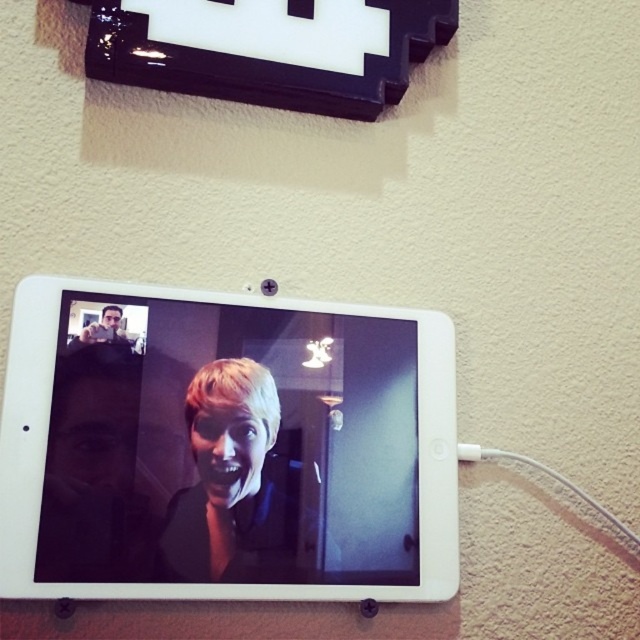
Question: Is white glossy tablet at center above matte black face at upper left?

Choices:
 (A) yes
 (B) no

Answer: (B)

Question: Is matte black face at left wider than matte black face at upper left?

Choices:
 (A) no
 (B) yes

Answer: (B)

Question: Is white glossy tablet at center closer to camera compared to matte black face at left?

Choices:
 (A) yes
 (B) no

Answer: (A)

Question: Estimate the real-world distances between objects in this image. Which object is farther from the white glossy tablet at center?

Choices:
 (A) matte black face at left
 (B) matte black face at upper left

Answer: (B)

Question: Among these points, which one is farthest from the camera?

Choices:
 (A) (248, 476)
 (B) (60, 394)

Answer: (A)

Question: Considering the real-world distances, which object is farthest from the matte black face at upper left?

Choices:
 (A) matte black face at left
 (B) white glossy tablet at center

Answer: (B)